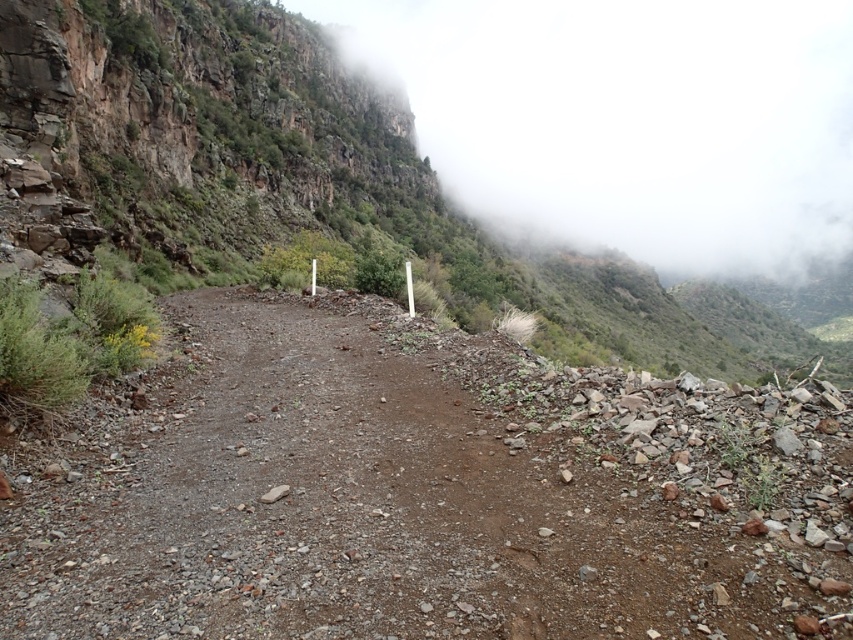
You are a hiker planning to traverse the dull brown dirt track at center. There is a foggy misty cliff at upper center above you. Do you think the trail is safe to walk on?

The dull brown dirt track at center is below the foggy misty cliff at upper center, so there is a risk of falling rocks or debris from the cliff above. The trail may not be safe to walk on due to potential hazards from the cliff.

You are navigating a mountain trail and need to find the dull brown dirt track at center. According to the map, your current position is at point 0.770, 0.492. Is the track ahead of you or behind you?

The dull brown dirt track at center is located at point (419, 492), so you are exactly at the track. It is neither ahead nor behind you.